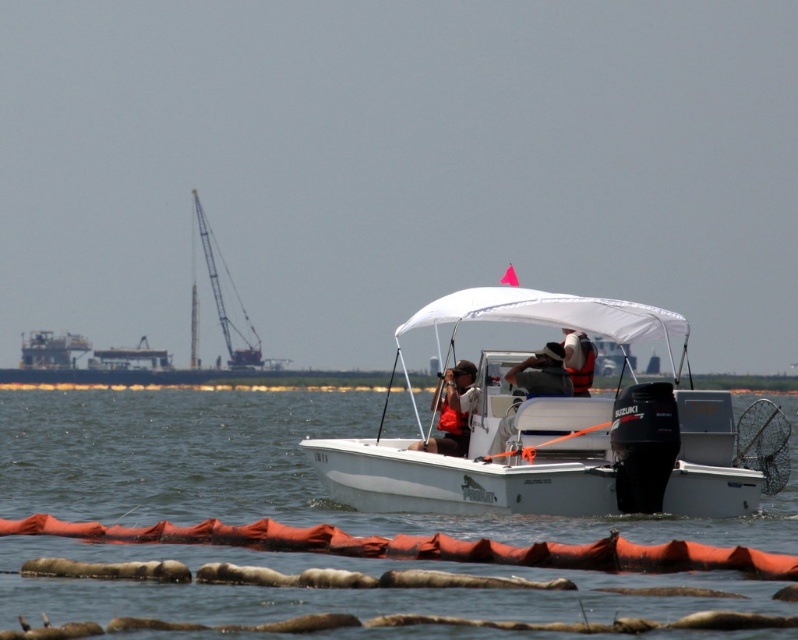
You are a safety inspector on the motorboat and need to check the distance between the matte orange life vest at center and the camera. According to regulations, the maximum allowable distance between a life vest and any camera on board must not exceed 60 feet to ensure quick access in emergencies. Is the current placement compliant with safety regulations?

The matte orange life vest at center and the camera are 67.13 feet apart from each other, which exceeds the 60 feet maximum allowable distance. Therefore, the current placement does not comply with safety regulations.